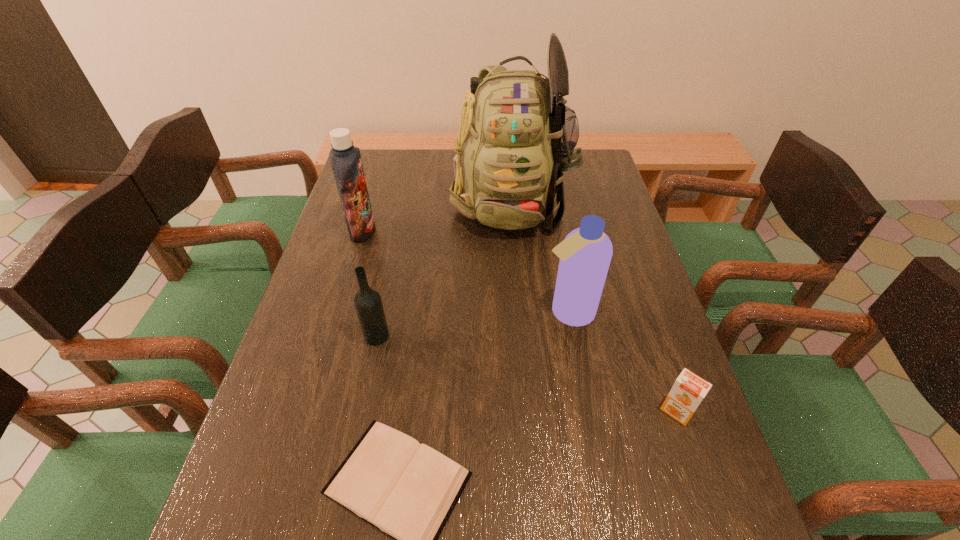
Locate an element on the screen. object that is the fourth closest to the nearer shampoo is located at coordinates (368, 304).

I want to click on free space that satisfies the following two spatial constraints: 1. on the front label of the fourth tallest object; 2. on the left side of the farther shampoo, so pyautogui.click(x=331, y=336).

This screenshot has height=540, width=960. I want to click on blank space that satisfies the following two spatial constraints: 1. on the front-facing side of the right shampoo; 2. on the left side of the tallest object, so click(521, 312).